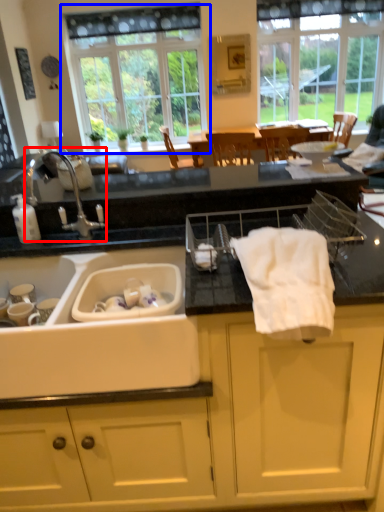
Question: Among these objects, which one is nearest to the camera, tap (highlighted by a red box) or window (highlighted by a blue box)?

Choices:
 (A) tap
 (B) window

Answer: (A)